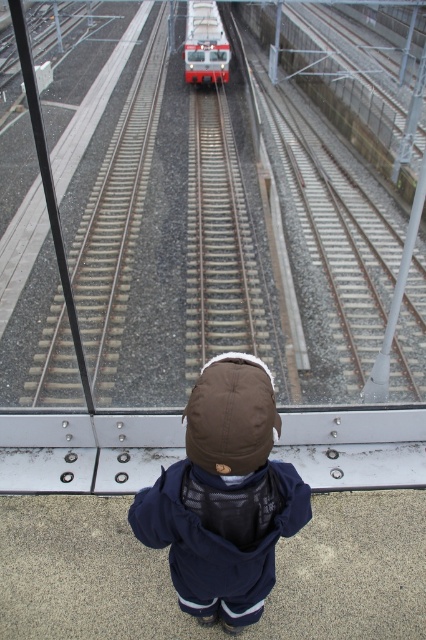
Based on the photo, which of these two, brown fleece jacket at center or red glossy train at center, stands shorter?

With less height is brown fleece jacket at center.

Which of these two, brown fleece jacket at center or red glossy train at center, stands taller?

Standing taller between the two is red glossy train at center.

In order to click on brown fleece jacket at center in this screenshot , I will do `click(224, 496)`.

In order to click on brown fleece jacket at center in this screenshot , I will do `click(224, 496)`.